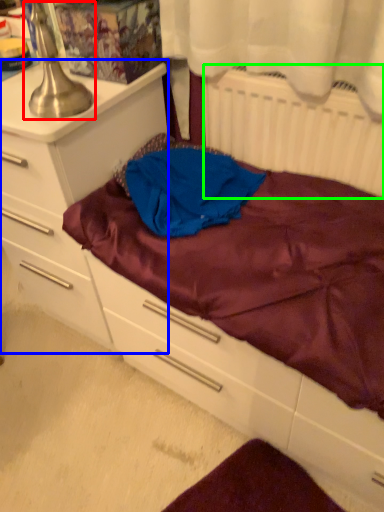
Question: Based on their relative distances, which object is farther from table lamp (highlighted by a red box)? Choose from chest of drawers (highlighted by a blue box) and radiator (highlighted by a green box).

Choices:
 (A) chest of drawers
 (B) radiator

Answer: (B)